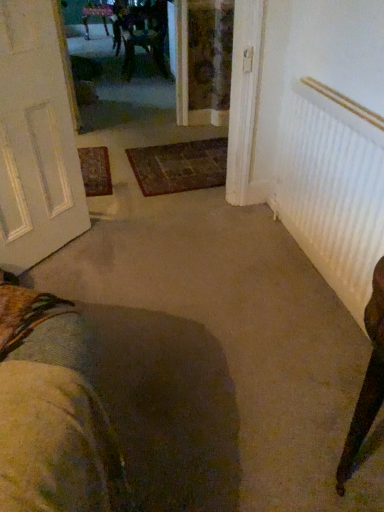
Measure the distance between point (160, 57) and camera.

5.07 meters.

The width and height of the screenshot is (384, 512). Describe the element at coordinates (179, 166) in the screenshot. I see `carpeted doormat at center` at that location.

The height and width of the screenshot is (512, 384). Identify the location of wooden chair at upper center. (144, 35).

This screenshot has width=384, height=512. Identify the location of chair behind the carpeted doormat at center. (144, 35).

Is carpeted doormat at center located within wooden chair at upper center?

No, wooden chair at upper center does not contain carpeted doormat at center.

Which is more to the left, wooden chair at upper center or carpeted doormat at center?

wooden chair at upper center is more to the left.

Is wooden chair at upper center facing away from carpeted doormat at center?

That's not correct — wooden chair at upper center is not looking away from carpeted doormat at center.

Is white ribbed radiator at right taller or shorter than carpeted doormat at center?

Clearly, white ribbed radiator at right is taller compared to carpeted doormat at center.

From the image's perspective, is white ribbed radiator at right located beneath carpeted doormat at center?

Indeed, from the image's perspective, white ribbed radiator at right is shown beneath carpeted doormat at center.

The image size is (384, 512). Identify the location of radiator below the carpeted doormat at center (from the image's perspective). (334, 188).

Is white ribbed radiator at right looking in the opposite direction of carpeted doormat at center?

No, white ribbed radiator at right's orientation is not away from carpeted doormat at center.

From the image's perspective, between white ribbed radiator at right and white textured door at left, who is located below?

white ribbed radiator at right.

Is white ribbed radiator at right outside of white textured door at left?

white ribbed radiator at right is positioned outside white textured door at left.

Does white ribbed radiator at right lie in front of white textured door at left?

Yes, white ribbed radiator at right is in front of white textured door at left.

Is white ribbed radiator at right not near white textured door at left?

Indeed, white ribbed radiator at right is not near white textured door at left.

Between white textured door at left and wooden chair at upper center, which one has smaller size?

white textured door at left.

Which is more to the left, white textured door at left or wooden chair at upper center?

white textured door at left.

From the image's perspective, is white textured door at left above or below wooden chair at upper center?

Clearly, from the image's perspective, white textured door at left is below wooden chair at upper center.

Is point (153, 195) less distant than point (125, 39)?

Yes, point (153, 195) is closer to viewer.

Considering the relative sizes of carpeted doormat at center and wooden chair at upper center in the image provided, is carpeted doormat at center bigger than wooden chair at upper center?

Incorrect, carpeted doormat at center is not larger than wooden chair at upper center.

Considering the sizes of objects carpeted doormat at center and wooden chair at upper center in the image provided, who is shorter, carpeted doormat at center or wooden chair at upper center?

carpeted doormat at center is shorter.

In the scene shown: Measure the distance from carpeted doormat at center to wooden chair at upper center.

carpeted doormat at center is 8.00 feet from wooden chair at upper center.

Is carpeted doormat at center positioned far away from white ribbed radiator at right?

Yes, carpeted doormat at center is far from white ribbed radiator at right.

Between carpeted doormat at center and white ribbed radiator at right, which one has more height?

white ribbed radiator at right.

Is carpeted doormat at center oriented away from white ribbed radiator at right?

No, carpeted doormat at center's orientation is not away from white ribbed radiator at right.

Does wooden chair at upper center turn towards white ribbed radiator at right?

No, wooden chair at upper center is not facing towards white ribbed radiator at right.

Is wooden chair at upper center directly adjacent to white ribbed radiator at right?

No, wooden chair at upper center is not touching white ribbed radiator at right.

Between wooden chair at upper center and white ribbed radiator at right, which one is positioned in front?

white ribbed radiator at right is closer to the camera.

The height and width of the screenshot is (512, 384). I want to click on chair above the carpeted doormat at center (from the image's perspective), so click(x=144, y=35).

At what (x,y) coordinates should I click in order to perform the action: click on radiator above the carpeted doormat at center (from a real-world perspective). Please return your answer as a coordinate pair (x, y). This screenshot has width=384, height=512. Looking at the image, I should click on 334,188.

Which object lies further to the anchor point white textured door at left, carpeted doormat at center or white ribbed radiator at right?

Based on the image, white ribbed radiator at right appears to be further to white textured door at left.

Based on their spatial positions, is wooden chair at upper center or white textured door at left closer to white ribbed radiator at right?

white textured door at left is closer to white ribbed radiator at right.

When comparing their distances from carpeted doormat at center, does wooden chair at upper center or white textured door at left seem further?

wooden chair at upper center lies further to carpeted doormat at center than the other object.

From the image, which object appears to be farther from carpeted doormat at center, white textured door at left or white ribbed radiator at right?

Among the two, white ribbed radiator at right is located further to carpeted doormat at center.

Based on their spatial positions, is carpeted doormat at center or white ribbed radiator at right further from wooden chair at upper center?

white ribbed radiator at right lies further to wooden chair at upper center than the other object.

Looking at the image, which one is located further to wooden chair at upper center, white textured door at left or carpeted doormat at center?

white textured door at left lies further to wooden chair at upper center than the other object.

Based on the photo, when comparing their distances from white textured door at left, does white ribbed radiator at right or wooden chair at upper center seem further?

Among the two, wooden chair at upper center is located further to white textured door at left.

Based on their spatial positions, is wooden chair at upper center or carpeted doormat at center further from white textured door at left?

wooden chair at upper center is positioned further to the anchor white textured door at left.

I want to click on door between white ribbed radiator at right and carpeted doormat at center in the front-back direction, so click(x=36, y=139).

In order to click on doormat between white textured door at left and wooden chair at upper center in the front-back direction in this screenshot , I will do tap(179, 166).

Where is `doormat positioned between white ribbed radiator at right and wooden chair at upper center from near to far`? Image resolution: width=384 pixels, height=512 pixels. doormat positioned between white ribbed radiator at right and wooden chair at upper center from near to far is located at coordinates (179, 166).

Identify the location of door between white ribbed radiator at right and wooden chair at upper center in the front-back direction. (36, 139).